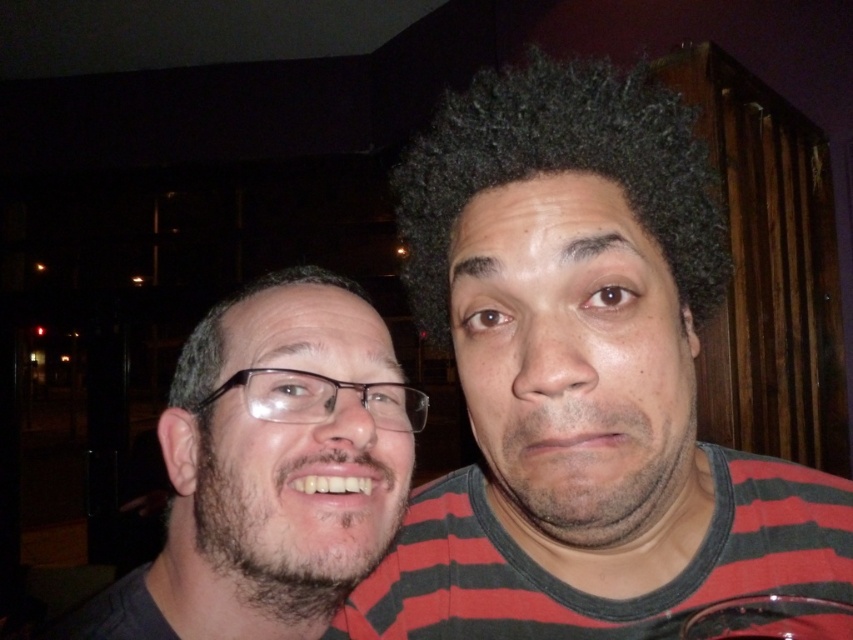
Which is behind, point (543, 634) or point (503, 104)?

The point (543, 634) is behind.

Which is more to the left, dark green striped shirt at right or dark curly hair at center?

dark green striped shirt at right

Is point (552, 216) more distant than point (602, 147)?

No, it is not.

Find the location of a particular element. dark green striped shirt at right is located at coordinates (581, 378).

Which is in front, point (619, 611) or point (730, 602)?

Point (730, 602)

Does dark green striped shirt at right have a lesser height compared to transparent plastic wine glass at lower right?

In fact, dark green striped shirt at right may be taller than transparent plastic wine glass at lower right.

Image resolution: width=853 pixels, height=640 pixels. What are the coordinates of `dark green striped shirt at right` in the screenshot? It's located at (581, 378).

Can you confirm if dark green striped shirt at right is smaller than matte black glasses at left?

Actually, dark green striped shirt at right might be larger than matte black glasses at left.

Is point (621, 262) behind point (186, 515)?

No, (621, 262) is in front of (186, 515).

The width and height of the screenshot is (853, 640). Find the location of `dark green striped shirt at right`. dark green striped shirt at right is located at coordinates (581, 378).